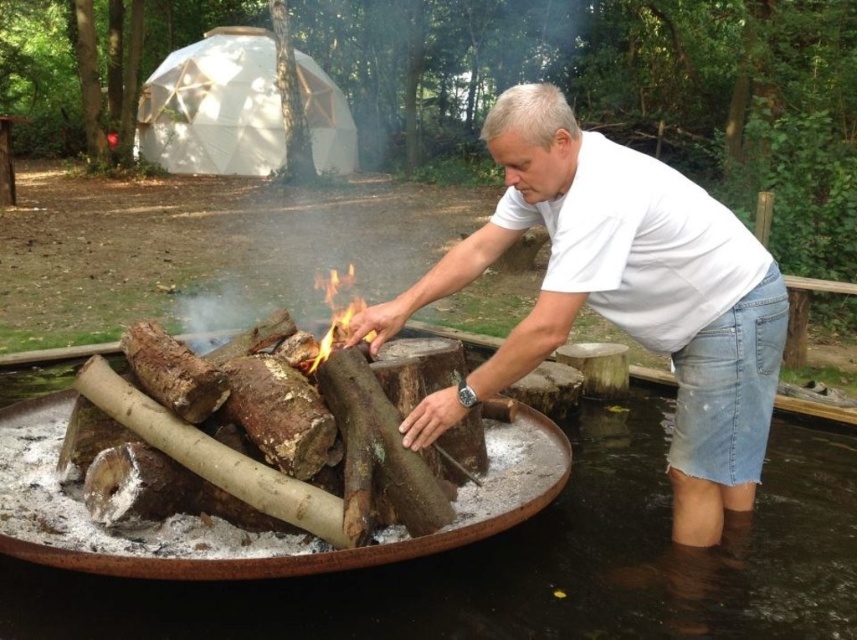
Question: Does white cotton shirt at center appear under charred wood fire at center?

Choices:
 (A) yes
 (B) no

Answer: (A)

Question: Is white cotton shirt at center thinner than charred wood fire at center?

Choices:
 (A) yes
 (B) no

Answer: (B)

Question: Does white cotton shirt at center have a lesser width compared to charred wood fire at center?

Choices:
 (A) yes
 (B) no

Answer: (B)

Question: Which point is closer to the camera taking this photo?

Choices:
 (A) (572, 161)
 (B) (304, 368)

Answer: (A)